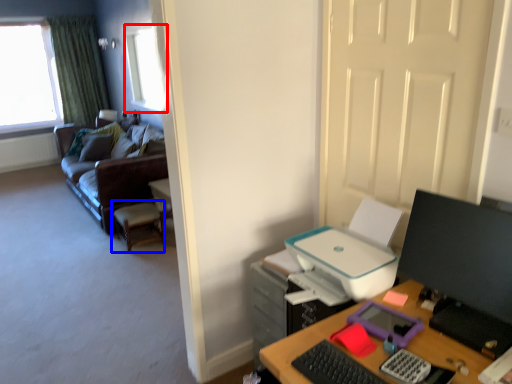
Question: Which of the following is the farthest to the observer, window (highlighted by a red box) or computer chair (highlighted by a blue box)?

Choices:
 (A) window
 (B) computer chair

Answer: (A)